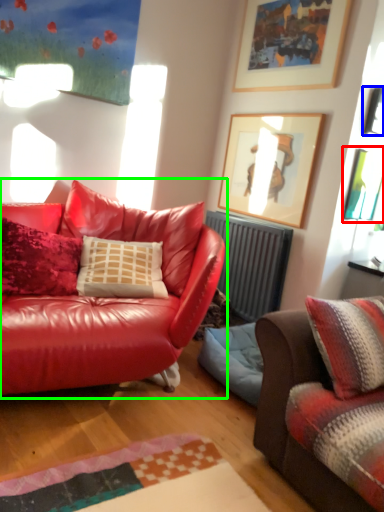
Question: Which object is positioned farthest from picture frame (highlighted by a red box)? Select from picture frame (highlighted by a blue box) and studio couch (highlighted by a green box).

Choices:
 (A) picture frame
 (B) studio couch

Answer: (B)